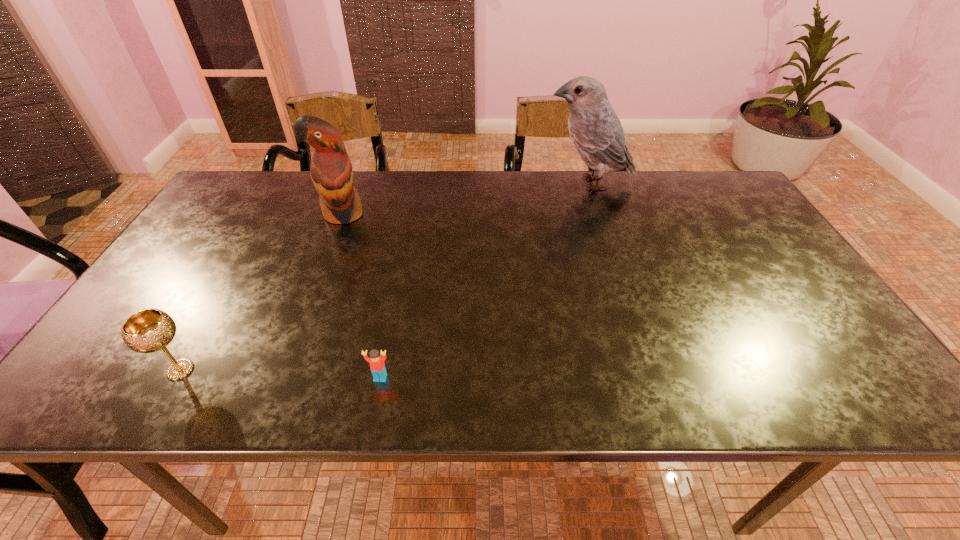
The width and height of the screenshot is (960, 540). What are the coordinates of `vacant space at the right edge of the desktop` in the screenshot? It's located at [751, 228].

You are a GUI agent. You are given a task and a screenshot of the screen. Output one action in this format:
    pyautogui.click(x=<x>, y=<y>)
    Task: Click on the vacant region at the far left corner of the desktop
    The width and height of the screenshot is (960, 540).
    Given the screenshot: What is the action you would take?
    pyautogui.click(x=276, y=175)

Where is `vacant area between the Lego and the leftmost object`? The height and width of the screenshot is (540, 960). vacant area between the Lego and the leftmost object is located at coordinates (280, 374).

This screenshot has height=540, width=960. In order to click on empty space that is in between the shortest object and the right parrot in this screenshot , I will do [x=485, y=280].

What are the coordinates of `unoccupied position between the right parrot and the third nearest object` in the screenshot? It's located at (466, 199).

Locate an element on the screen. vacant space in between the chalice and the shortest object is located at coordinates (280, 374).

Where is `vacant area between the right parrot and the second object from right to left`? vacant area between the right parrot and the second object from right to left is located at coordinates (485, 280).

Locate an element on the screen. The height and width of the screenshot is (540, 960). empty space between the right parrot and the nearer parrot is located at coordinates (466, 199).

Where is `empty space between the third object from right to left and the chalice`? empty space between the third object from right to left and the chalice is located at coordinates (261, 292).

Locate an element on the screen. vacant space that is in between the second object from left to right and the chalice is located at coordinates click(x=261, y=292).